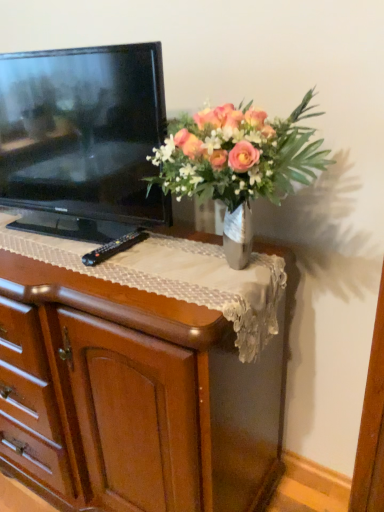
Find the location of a particular element. spots to the right of black plastic remote at center is located at coordinates (170, 250).